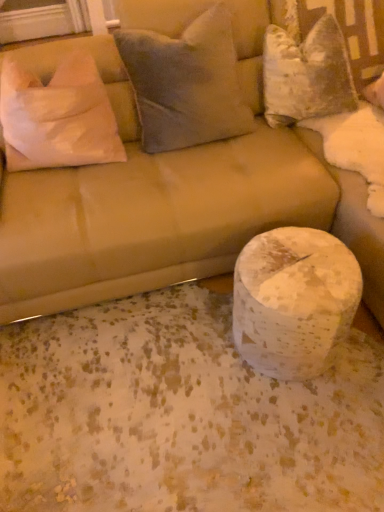
Locate an element on the screen. vacant space situated above white speckled marble at lower right (from a real-world perspective) is located at coordinates (302, 267).